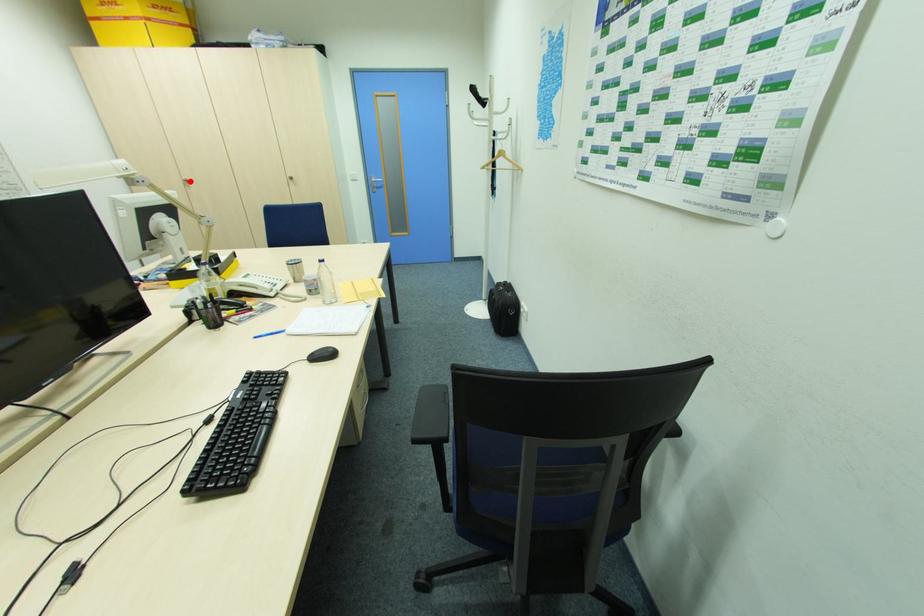
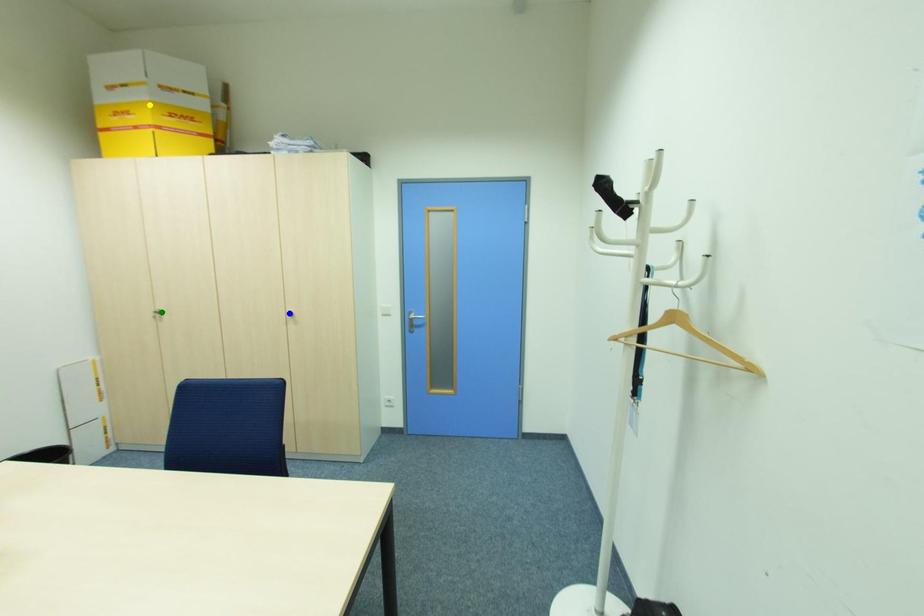
Question: I am providing you with two images of the same scene from different viewpoints. A red point is marked on the first image. You are given multiple points on the second image. Can you choose the point in image 2 that corresponds to the point in image 1?

Choices:
 (A) blue point
 (B) yellow point
 (C) green point

Answer: (C)